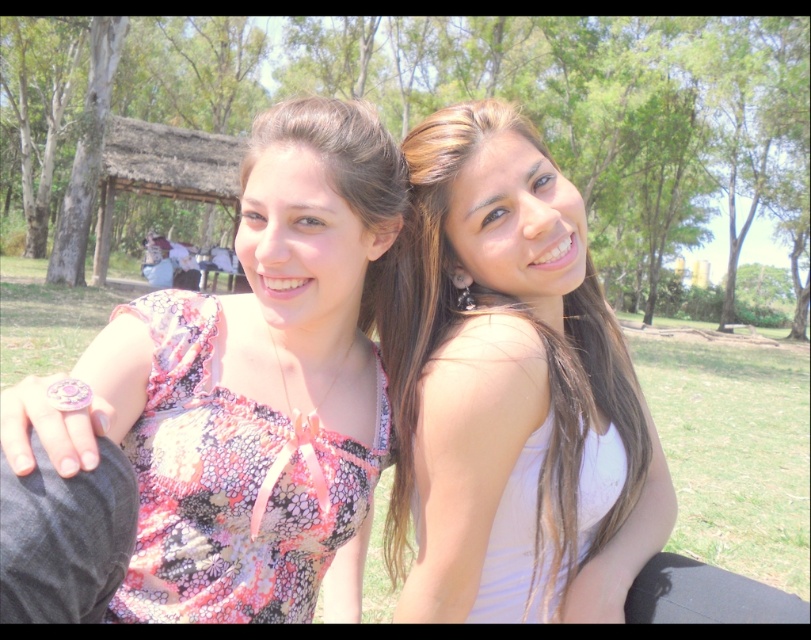
Where is the floral fabric dress at center located in the image?

The floral fabric dress at center is located at point (267, 385).